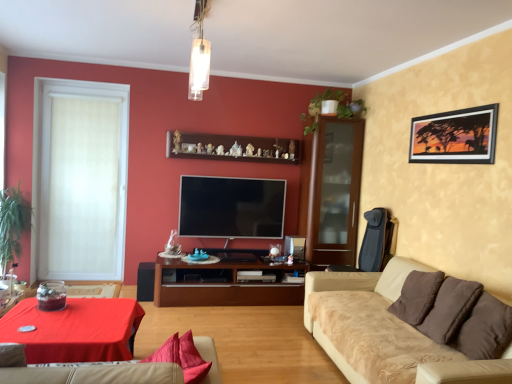
Where is `vacant region in front of wooden cabinet at center`? vacant region in front of wooden cabinet at center is located at coordinates (231, 327).